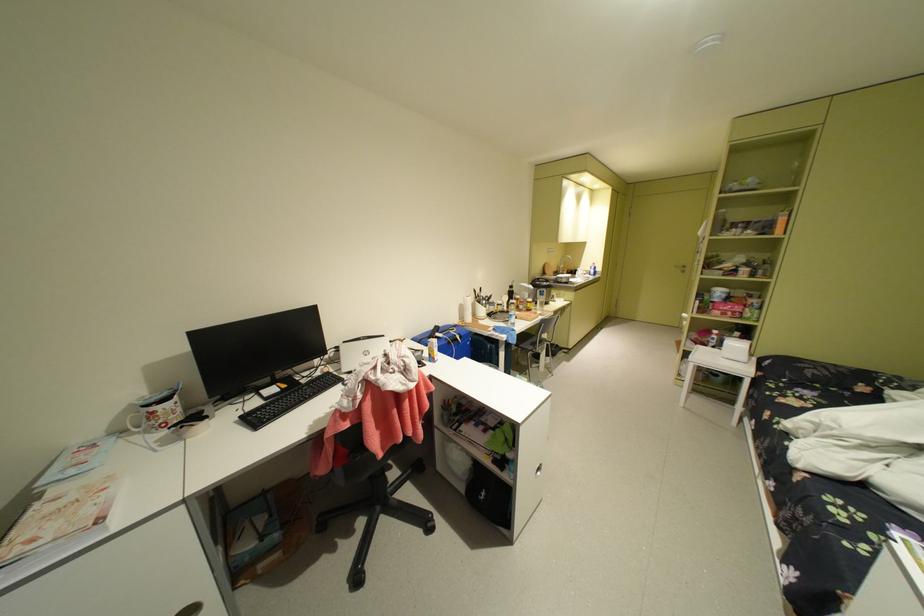
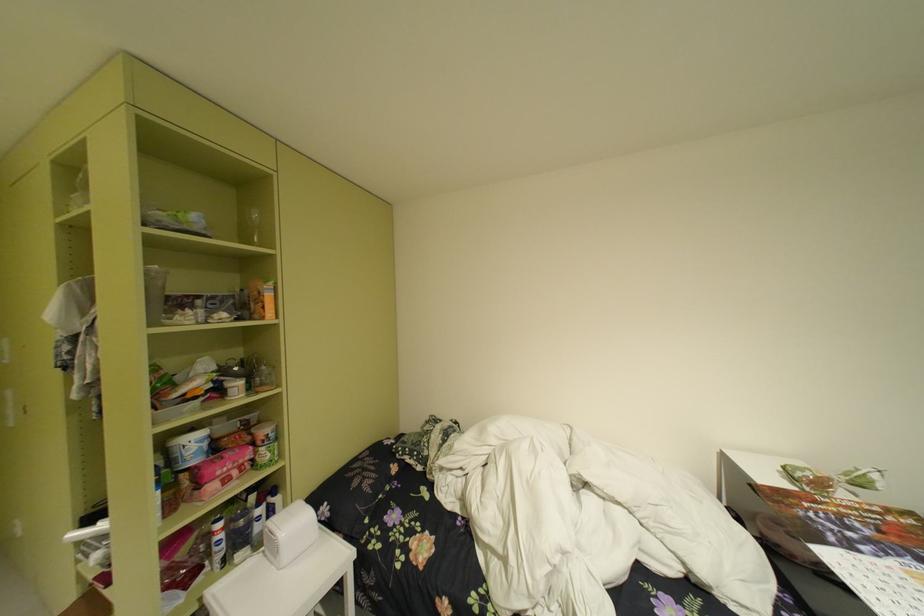
Find the pixel in the second image that matches (740,304) in the first image.

(238, 455)